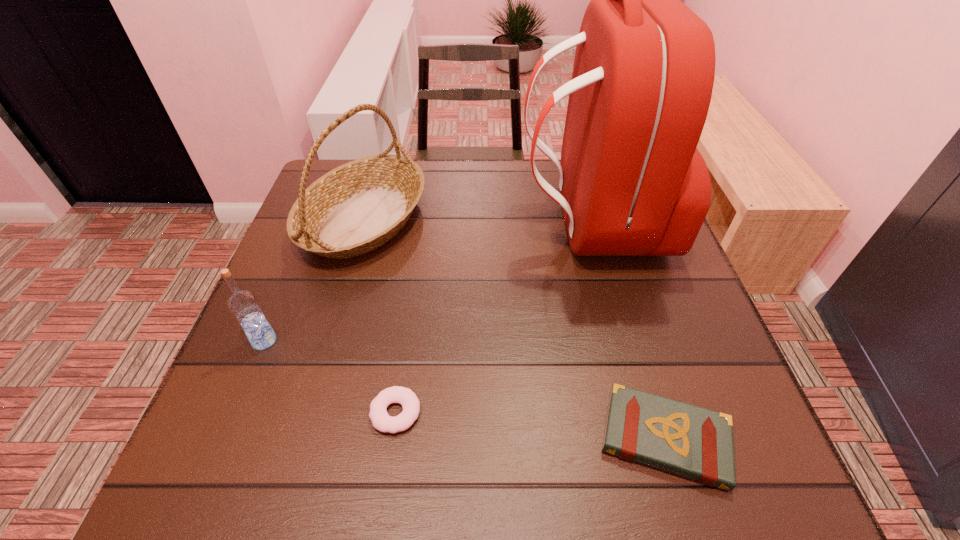
Locate an element on the screen. object that is the closest one to the tallest object is located at coordinates (357, 207).

This screenshot has height=540, width=960. I want to click on free spot that satisfies the following two spatial constraints: 1. on the strap side of the book; 2. on the right side of the tallest object, so click(x=648, y=438).

Where is `vacant space that satisfies the following two spatial constraints: 1. on the front side of the third tallest object; 2. on the left side of the shortest object`? vacant space that satisfies the following two spatial constraints: 1. on the front side of the third tallest object; 2. on the left side of the shortest object is located at coordinates (235, 412).

Identify the location of vacant position in the image that satisfies the following two spatial constraints: 1. on the strap side of the tallest object; 2. on the back side of the fourth tallest object. This screenshot has width=960, height=540. (648, 438).

Where is `free space that satisfies the following two spatial constraints: 1. on the back side of the third farthest object; 2. on the left side of the basket`? free space that satisfies the following two spatial constraints: 1. on the back side of the third farthest object; 2. on the left side of the basket is located at coordinates (315, 219).

Locate an element on the screen. This screenshot has width=960, height=540. free space in the image that satisfies the following two spatial constraints: 1. on the strap side of the backpack; 2. on the back side of the book is located at coordinates [648, 438].

Locate an element on the screen. This screenshot has height=540, width=960. vacant area that satisfies the following two spatial constraints: 1. on the back side of the fourth tallest object; 2. on the strap side of the tallest object is located at coordinates (601, 224).